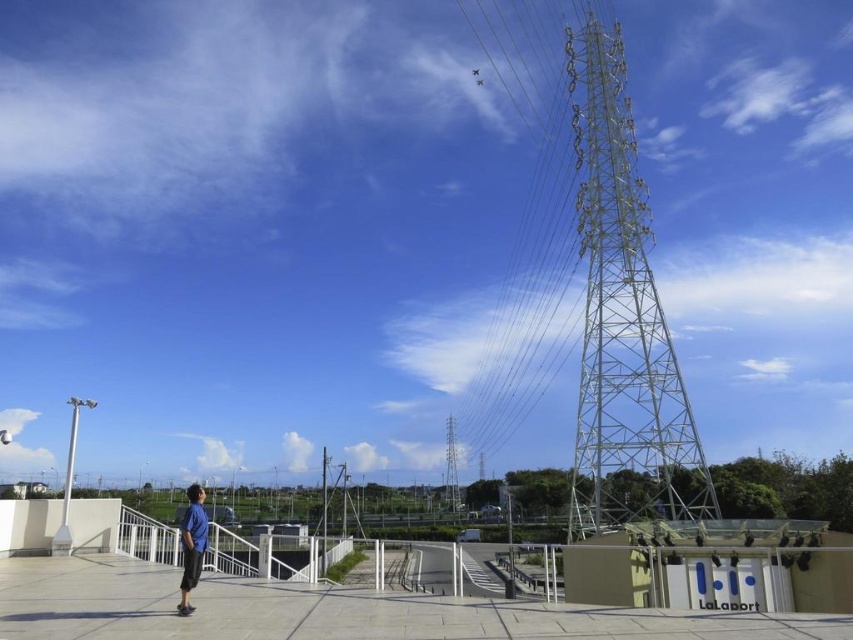
Is point (659, 621) less distant than point (201, 545)?

Yes, point (659, 621) is in front of point (201, 545).

Image resolution: width=853 pixels, height=640 pixels. Describe the element at coordinates (332, 611) in the screenshot. I see `white concrete path at center` at that location.

This screenshot has width=853, height=640. What are the coordinates of `white concrete path at center` in the screenshot? It's located at coord(332,611).

Is point (691, 621) closer to camera compared to point (454, 458)?

Yes, point (691, 621) is closer to viewer.

Describe the element at coordinates (332, 611) in the screenshot. I see `white concrete path at center` at that location.

The width and height of the screenshot is (853, 640). In order to click on white concrete path at center in this screenshot , I will do coord(332,611).

Between metallic silver tower at right and white concrete path at center, which one appears on the right side from the viewer's perspective?

Positioned to the right is metallic silver tower at right.

Does metallic silver tower at right come behind white concrete path at center?

Yes, metallic silver tower at right is behind white concrete path at center.

Who is more forward, [578,97] or [723,637]?

Positioned in front is point [723,637].

You are a GUI agent. You are given a task and a screenshot of the screen. Output one action in this format:
    pyautogui.click(x=<x>, y=<y>)
    Task: Click on the metallic silver tower at right
    The width and height of the screenshot is (853, 640).
    Given the screenshot: What is the action you would take?
    pyautogui.click(x=622, y=321)